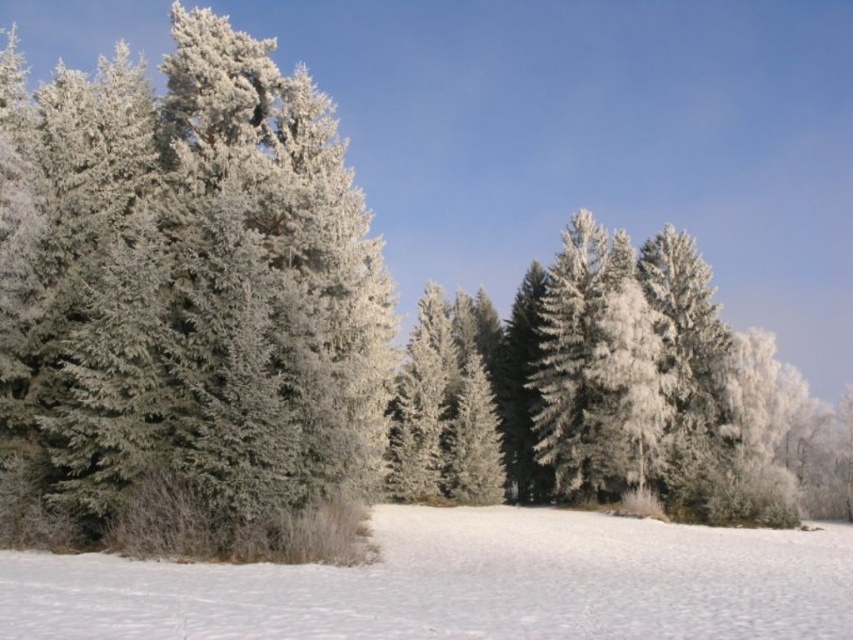
You are standing at the center of the snowy field and want to reach the frosted pine tree at left. Which direction should you walk to get there?

You should walk to the left to reach the frosted pine tree at left since it is located at point (190,305), which is to the left of your current position at the center.

You are standing at the center of the snow field in the winter landscape. You see a point marked at coordinates point (190, 305). Which object is this point located on?

The point (190, 305) is located on the frosted pine tree at left.

You are standing at the point with coordinates point (579,570) and want to walk to the point with coordinates point (779,467). Which direction should you move relative to your current position?

To reach point (779,467) from point (579,570), you should move backward since point (779,467) is behind point (579,570) relative to your current position.